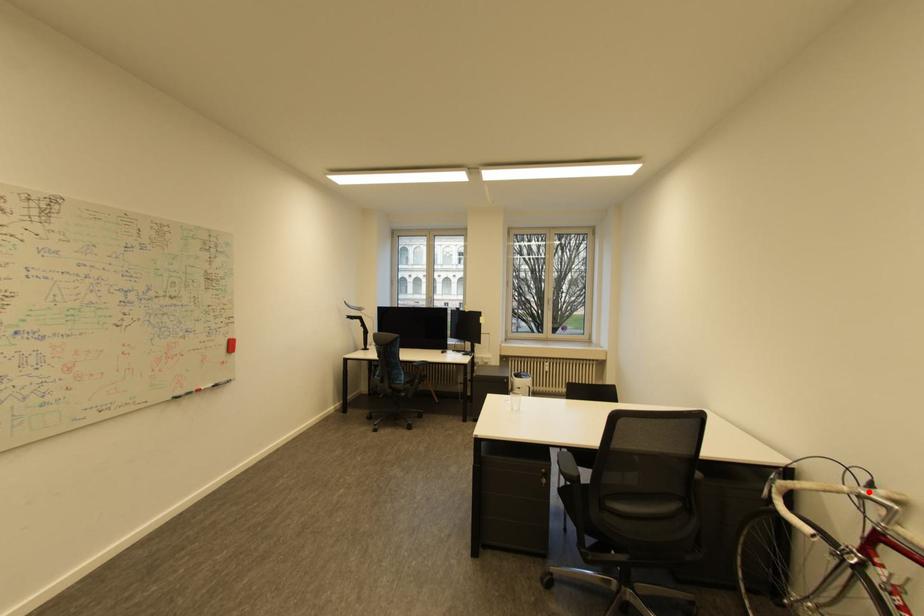
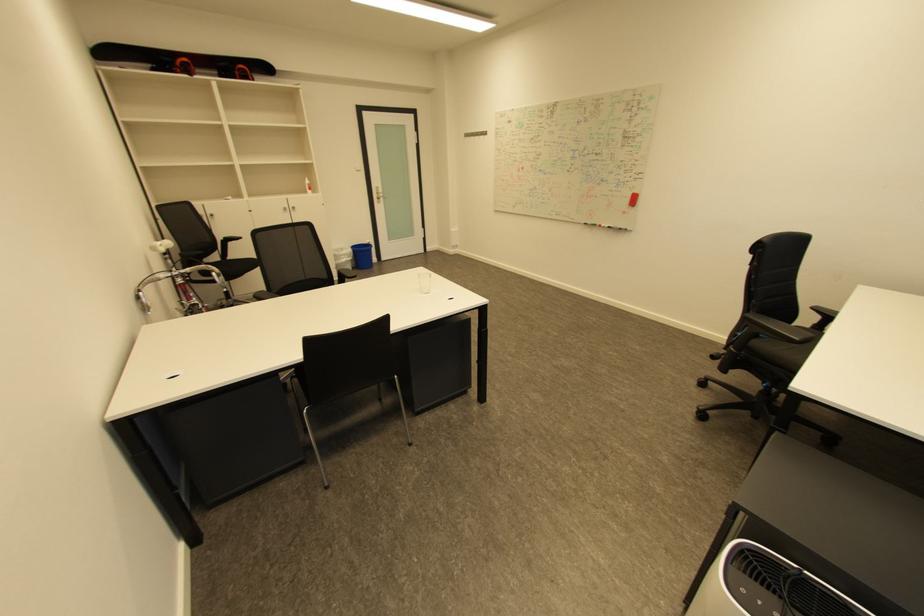
Question: I am providing you with two images of the same scene from different viewpoints. A red point is marked on the first image. Is the red point's position out of view in image 2?

Choices:
 (A) Yes
 (B) No

Answer: (A)